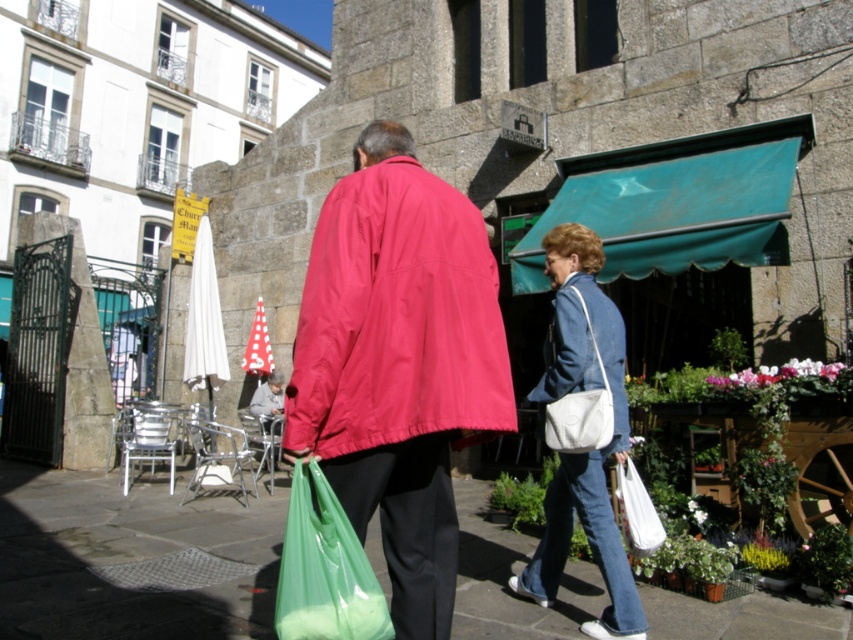
You are a delivery person standing in the middle of the street. You need to deliver a package to the person wearing the matte red jacket at center. If your drone can fly up to 3 meters, will it be able to reach them?

A: The matte red jacket at center and viewer are 2.55 meters apart. Since the drone can fly up to 3 meters, it will be able to reach the person wearing the matte red jacket at center.

You are a photographer trying to capture the person in the matte red jacket at center without including the green plastic bag at center in the shot. Based on their positions, can you position yourself to do so?

The matte red jacket at center is located above the green plastic bag at center, so positioning yourself slightly lower or adjusting your angle to focus on the jacket while excluding the bag below it should work.